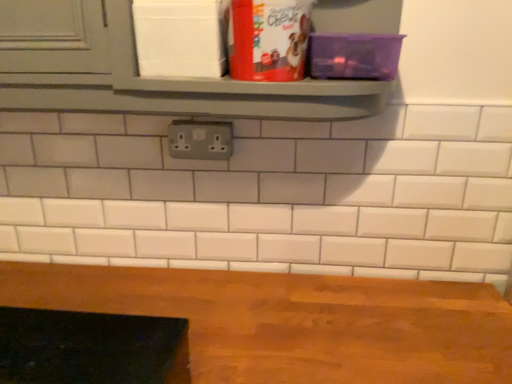
The image size is (512, 384). I want to click on gray plastic outlet at center, so click(200, 140).

Image resolution: width=512 pixels, height=384 pixels. What do you see at coordinates (200, 140) in the screenshot?
I see `gray plastic outlet at center` at bounding box center [200, 140].

What is the approximate width of wooden table at bottom?

15.05 inches.

Describe the element at coordinates (294, 321) in the screenshot. I see `wooden table at bottom` at that location.

The height and width of the screenshot is (384, 512). Find the location of `wooden table at bottom`. wooden table at bottom is located at coordinates (294, 321).

Locate an element on the screen. This screenshot has height=384, width=512. gray plastic outlet at center is located at coordinates (200, 140).

Based on the photo, considering the relative positions of gray plastic outlet at center and wooden table at bottom in the image provided, is gray plastic outlet at center to the left of wooden table at bottom from the viewer's perspective?

Indeed, gray plastic outlet at center is positioned on the left side of wooden table at bottom.

Does gray plastic outlet at center come behind wooden table at bottom?

Yes, it is.

Does point (215, 134) lie in front of point (190, 339)?

No, (215, 134) is behind (190, 339).

From the image's perspective, is gray plastic outlet at center over wooden table at bottom?

Yes, from the image's perspective, gray plastic outlet at center is on top of wooden table at bottom.

From the picture: From a real-world perspective, which is physically above, gray plastic outlet at center or wooden table at bottom?

gray plastic outlet at center, from a real-world perspective.

Between gray plastic outlet at center and wooden table at bottom, which one has larger width?

Wider between the two is wooden table at bottom.

From their relative heights in the image, would you say gray plastic outlet at center is taller or shorter than wooden table at bottom?

Considering their sizes, gray plastic outlet at center has more height than wooden table at bottom.

Who is smaller, gray plastic outlet at center or wooden table at bottom?

Smaller between the two is gray plastic outlet at center.

Could wooden table at bottom be considered to be inside gray plastic outlet at center?

No, wooden table at bottom is not a part of gray plastic outlet at center.

Is gray plastic outlet at center not close to wooden table at bottom?

gray plastic outlet at center is actually quite close to wooden table at bottom.

Is wooden table at bottom at the back of gray plastic outlet at center?

gray plastic outlet at center does not have its back to wooden table at bottom.

The image size is (512, 384). Find the location of `table located on the right of gray plastic outlet at center`. table located on the right of gray plastic outlet at center is located at coordinates (294, 321).

Considering the relative positions of wooden table at bottom and gray plastic outlet at center in the image provided, is wooden table at bottom to the left of gray plastic outlet at center from the viewer's perspective?

In fact, wooden table at bottom is to the right of gray plastic outlet at center.

Relative to gray plastic outlet at center, is wooden table at bottom in front or behind?

Visually, wooden table at bottom is located in front of gray plastic outlet at center.

Is point (440, 351) farther from viewer compared to point (188, 120)?

No, it is in front of (188, 120).

From the image's perspective, is wooden table at bottom located above or below gray plastic outlet at center?

Based on their image positions, wooden table at bottom is located beneath gray plastic outlet at center.

From a real-world perspective, between wooden table at bottom and gray plastic outlet at center, who is vertically higher?

gray plastic outlet at center is physically above.

Considering the sizes of objects wooden table at bottom and gray plastic outlet at center in the image provided, who is thinner, wooden table at bottom or gray plastic outlet at center?

gray plastic outlet at center is thinner.

Does wooden table at bottom have a greater height compared to gray plastic outlet at center?

In fact, wooden table at bottom may be shorter than gray plastic outlet at center.

Is wooden table at bottom bigger than gray plastic outlet at center?

Indeed, wooden table at bottom has a larger size compared to gray plastic outlet at center.

Is gray plastic outlet at center a part of wooden table at bottom?

No, wooden table at bottom does not contain gray plastic outlet at center.

Is wooden table at bottom with gray plastic outlet at center?

There is a gap between wooden table at bottom and gray plastic outlet at center.

Is wooden table at bottom oriented away from gray plastic outlet at center?

No.

How far apart are wooden table at bottom and gray plastic outlet at center?

wooden table at bottom and gray plastic outlet at center are 16.82 inches apart.

This screenshot has width=512, height=384. In the image, there is a gray plastic outlet at center. In order to click on table below it (from the image's perspective) in this screenshot , I will do `click(294, 321)`.

Locate an element on the screen. table lying on the right of gray plastic outlet at center is located at coordinates (294, 321).

Where is `electric outlet on the left of the wooden table at bottom`? electric outlet on the left of the wooden table at bottom is located at coordinates (200, 140).